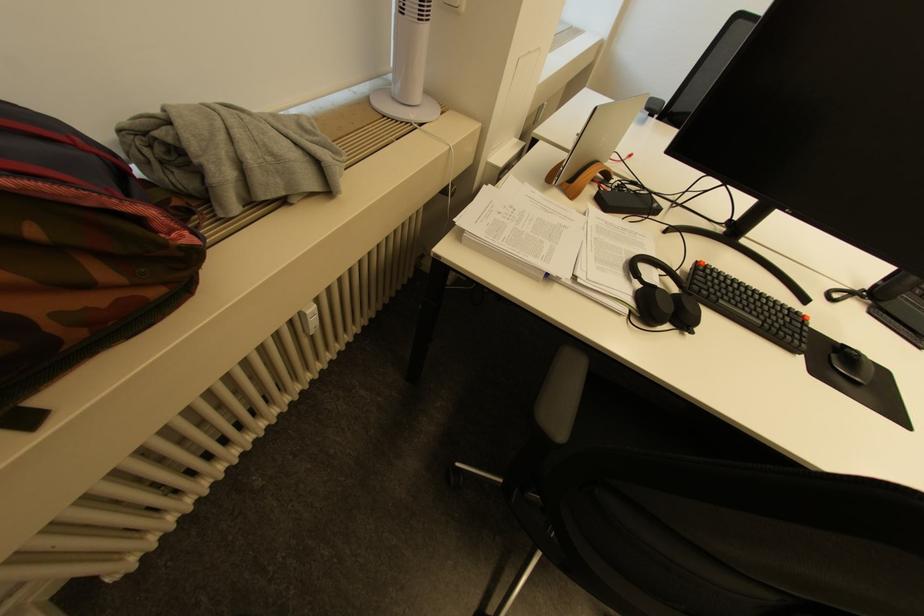
Image resolution: width=924 pixels, height=616 pixels. I want to click on black keyboard, so click(x=748, y=307).